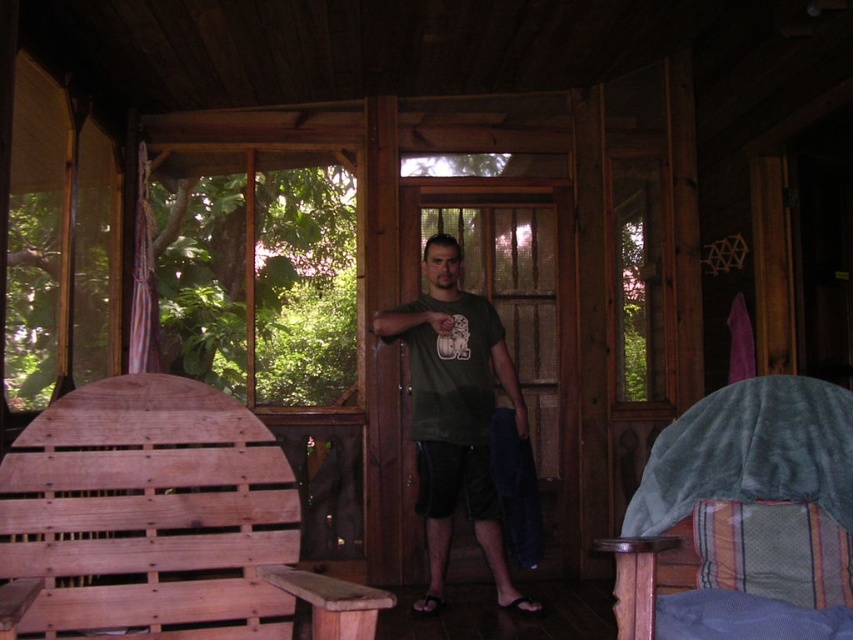
Between point (57, 621) and point (428, 304), which one is positioned behind?

The point (428, 304) is behind.

Describe the element at coordinates (161, 520) in the screenshot. I see `wooden chair at left` at that location.

Identify the location of wooden chair at left. The height and width of the screenshot is (640, 853). (161, 520).

You are a GUI agent. You are given a task and a screenshot of the screen. Output one action in this format:
    pyautogui.click(x=<x>, y=<y>)
    Task: Click on the wooden chair at left
    The height and width of the screenshot is (640, 853).
    Given the screenshot: What is the action you would take?
    pyautogui.click(x=161, y=520)

Who is more forward, (103, 545) or (831, 547)?

Positioned in front is point (103, 545).

Between point (82, 390) and point (817, 436), which one is positioned in front?

Point (82, 390) is in front.

The width and height of the screenshot is (853, 640). Find the location of `wooden chair at left`. wooden chair at left is located at coordinates (161, 520).

Is velvet green bed at right closer to the viewer compared to green matte t-shirt at center?

Yes, velvet green bed at right is in front of green matte t-shirt at center.

Is velvet green bed at right smaller than green matte t-shirt at center?

Yes, velvet green bed at right is smaller than green matte t-shirt at center.

Is point (705, 502) less distant than point (466, 310)?

Yes, it is in front of point (466, 310).

Find the location of a particular element. The height and width of the screenshot is (640, 853). velvet green bed at right is located at coordinates (746, 516).